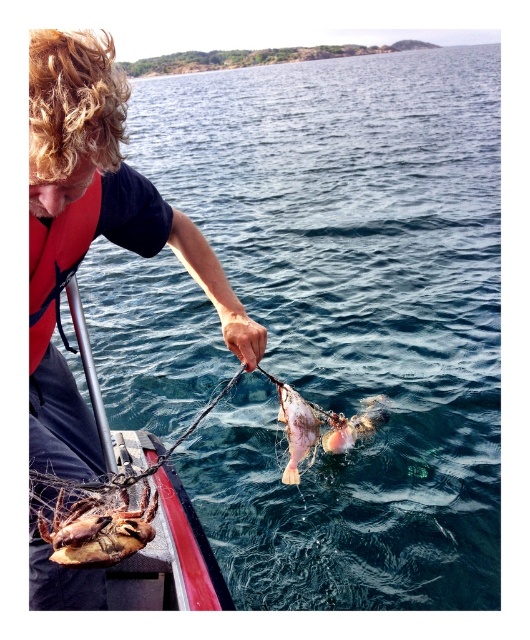
Does red life jacket at left appear on the left side of pink matte fish at center?

Yes, red life jacket at left is to the left of pink matte fish at center.

At what (x,y) coordinates should I click in order to perform the action: click on red life jacket at left. Please return your answer as a coordinate pair (x, y). The width and height of the screenshot is (530, 640). Looking at the image, I should click on (57, 262).

Between clear blue water at center and red life jacket at left, which one has less height?

red life jacket at left is shorter.

Does clear blue water at center appear on the left side of red life jacket at left?

Incorrect, clear blue water at center is not on the left side of red life jacket at left.

Is point (454, 515) closer to viewer compared to point (43, 282)?

No.

Where is `clear blue water at center`? clear blue water at center is located at coordinates (349, 317).

What do you see at coordinates (57, 262) in the screenshot? The width and height of the screenshot is (530, 640). I see `red life jacket at left` at bounding box center [57, 262].

Locate an element on the screen. This screenshot has height=640, width=530. red life jacket at left is located at coordinates (57, 262).

Which is behind, point (42, 243) or point (368, 429)?

Positioned behind is point (368, 429).

The image size is (530, 640). Identify the location of red life jacket at left. (57, 262).